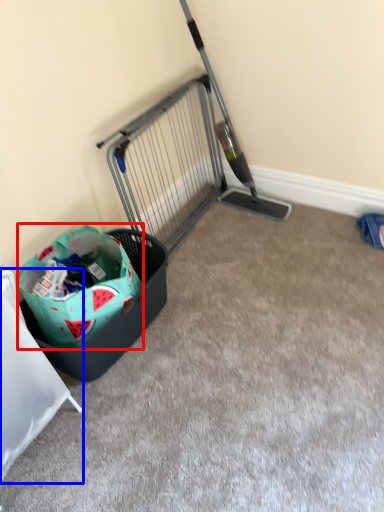
Question: Which object appears closest to the camera in this image, shopping bag (highlighted by a red box) or furniture (highlighted by a blue box)?

Choices:
 (A) shopping bag
 (B) furniture

Answer: (B)